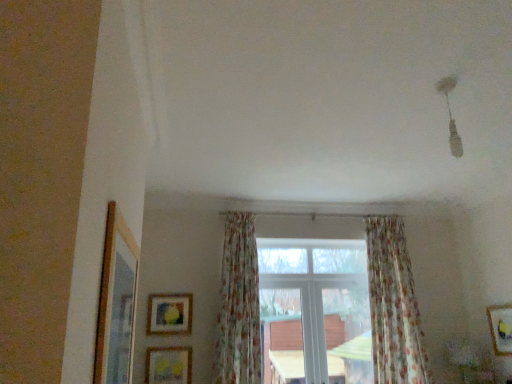
Question: Are wooden framed picture at lower right, which ranks as the 2th picture frame in front-to-back order, and white plastic window at center beside each other?

Choices:
 (A) yes
 (B) no

Answer: (B)

Question: Is wooden framed picture at lower right, the second picture frame in the bottom-to-top sequence, positioned far away from white plastic window at center?

Choices:
 (A) no
 (B) yes

Answer: (B)

Question: Is wooden framed picture at lower right, positioned as the third picture frame in top-to-bottom order, shorter than white plastic window at center?

Choices:
 (A) no
 (B) yes

Answer: (B)

Question: Considering the relative sizes of wooden framed picture at lower right, the 3th picture frame in the back-to-front sequence, and white plastic window at center in the image provided, is wooden framed picture at lower right, the 3th picture frame in the back-to-front sequence, smaller than white plastic window at center?

Choices:
 (A) yes
 (B) no

Answer: (A)

Question: Does wooden framed picture at lower right, the 3th picture frame in the back-to-front sequence, lie behind white plastic window at center?

Choices:
 (A) no
 (B) yes

Answer: (A)

Question: From the image's perspective, relative to wooden matte picture frame at lower left, which is the second picture frame in top-to-bottom order, is matte yellow picture frame at lower center, the third picture frame in the front-to-back sequence, above or below?

Choices:
 (A) below
 (B) above

Answer: (A)

Question: Considering the positions of matte yellow picture frame at lower center, marked as the 2th picture frame in a left-to-right arrangement, and wooden matte picture frame at lower left, which is the first picture frame in back-to-front order, in the image, is matte yellow picture frame at lower center, marked as the 2th picture frame in a left-to-right arrangement, taller or shorter than wooden matte picture frame at lower left, which is the first picture frame in back-to-front order,?

Choices:
 (A) tall
 (B) short

Answer: (B)

Question: Would you say matte yellow picture frame at lower center, marked as the 2th picture frame in a left-to-right arrangement, is inside or outside wooden matte picture frame at lower left, the 4th picture frame viewed from the front?

Choices:
 (A) outside
 (B) inside

Answer: (A)

Question: Considering their positions, is matte yellow picture frame at lower center, the third picture frame in the front-to-back sequence, located in front of or behind wooden matte picture frame at lower left, which is the first picture frame in back-to-front order?

Choices:
 (A) front
 (B) behind

Answer: (A)

Question: Is matte yellow picture frame at lower center, marked as the 2th picture frame in a back-to-front arrangement, inside or outside of white plastic window at center?

Choices:
 (A) outside
 (B) inside

Answer: (A)

Question: From the image's perspective, is matte yellow picture frame at lower center, positioned as the 3th picture frame in right-to-left order, positioned above or below white plastic window at center?

Choices:
 (A) above
 (B) below

Answer: (B)

Question: Is matte yellow picture frame at lower center, the third picture frame in the front-to-back sequence, to the left or to the right of white plastic window at center in the image?

Choices:
 (A) right
 (B) left

Answer: (B)

Question: Considering the positions of matte yellow picture frame at lower center, marked as the 2th picture frame in a left-to-right arrangement, and white plastic window at center in the image, is matte yellow picture frame at lower center, marked as the 2th picture frame in a left-to-right arrangement, bigger or smaller than white plastic window at center?

Choices:
 (A) big
 (B) small

Answer: (B)

Question: From their relative heights in the image, would you say floral fabric curtain at center, arranged as the 1th curtain when viewed from the left, is taller or shorter than floral fabric curtain at center, marked as the 2th curtain in a left-to-right arrangement?

Choices:
 (A) short
 (B) tall

Answer: (A)

Question: From the image's perspective, is floral fabric curtain at center, the second curtain when ordered from right to left, above or below floral fabric curtain at center, which is counted as the 1th curtain, starting from the right?

Choices:
 (A) above
 (B) below

Answer: (A)